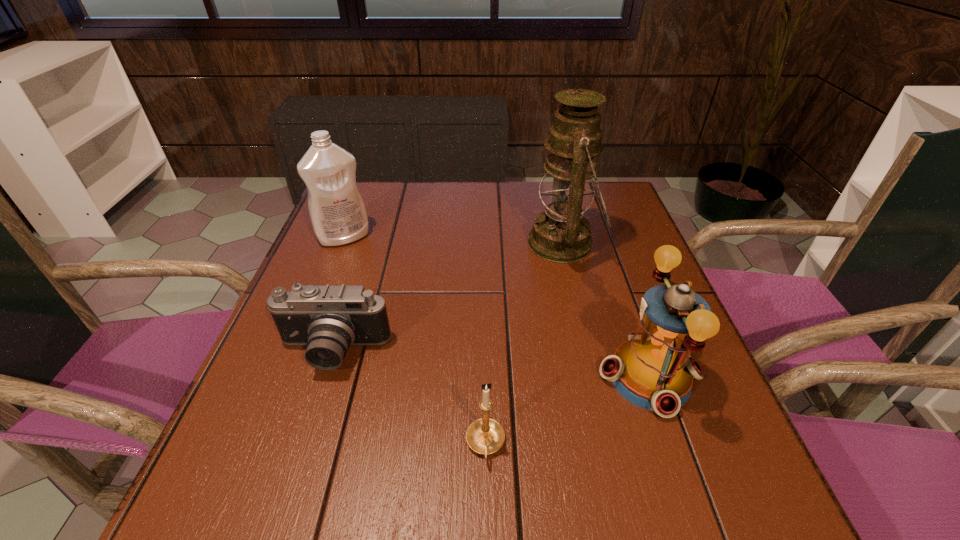
Identify the location of the tallest object. (562, 234).

Locate an element on the screen. This screenshot has width=960, height=540. detergent is located at coordinates (337, 212).

In order to click on the third tallest object in this screenshot , I will do `click(653, 370)`.

You are a GUI agent. You are given a task and a screenshot of the screen. Output one action in this format:
    pyautogui.click(x=<x>, y=<y>)
    Task: Click on the candle holder
    Image resolution: width=960 pixels, height=540 pixels.
    Given the screenshot: What is the action you would take?
    pyautogui.click(x=485, y=436)

This screenshot has width=960, height=540. Identify the location of camera. (327, 319).

The height and width of the screenshot is (540, 960). I want to click on free region located on the front of the oil lamp, so click(588, 343).

The height and width of the screenshot is (540, 960). I want to click on vacant space located on the right of the detergent, so click(x=515, y=237).

Where is `vacant region located 0.090m on the front-facing side of the third shortest object`? The width and height of the screenshot is (960, 540). vacant region located 0.090m on the front-facing side of the third shortest object is located at coordinates (550, 376).

Identify the location of vacant space positioned on the front-facing side of the third shortest object. The image size is (960, 540). (432, 376).

Where is `free space located 0.400m on the front-facing side of the third shortest object`? This screenshot has width=960, height=540. free space located 0.400m on the front-facing side of the third shortest object is located at coordinates (384, 376).